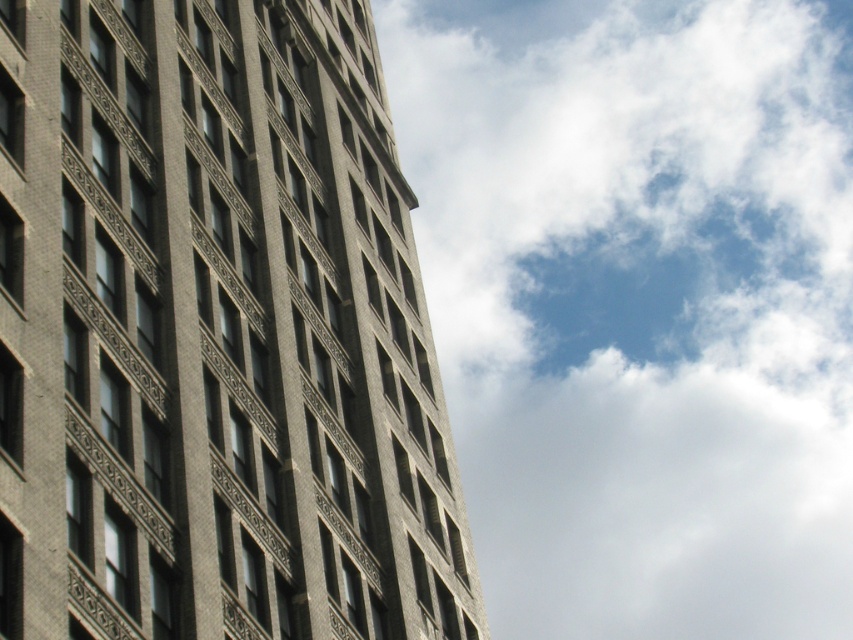
Question: Is gray brick building at center above white fluffy cloud at upper right?

Choices:
 (A) no
 (B) yes

Answer: (A)

Question: Which point is farther to the camera?

Choices:
 (A) white fluffy cloud at upper right
 (B) gray brick building at center

Answer: (A)

Question: Which point is farther from the camera taking this photo?

Choices:
 (A) tap(113, 388)
 (B) tap(405, 147)

Answer: (B)

Question: Does gray brick building at center come behind white fluffy cloud at upper right?

Choices:
 (A) yes
 (B) no

Answer: (B)

Question: Can you confirm if gray brick building at center is bigger than white fluffy cloud at upper right?

Choices:
 (A) yes
 (B) no

Answer: (B)